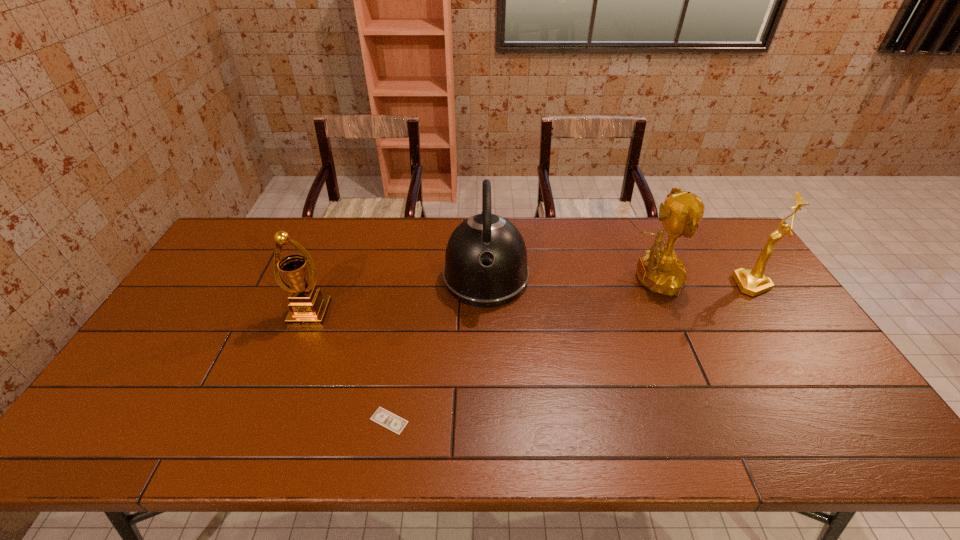
This screenshot has width=960, height=540. In order to click on vacant area that lies between the third object from left to right and the second award from right to left in this screenshot , I will do `click(567, 279)`.

What are the coordinates of `empty location between the shortest object and the second object from right to left` in the screenshot? It's located at (519, 350).

Find the location of a particular element. The width and height of the screenshot is (960, 540). unoccupied position between the rightmost object and the kettle is located at coordinates (619, 281).

Identify the location of vacant point located between the nearest object and the rightmost award. (571, 353).

You are a GUI agent. You are given a task and a screenshot of the screen. Output one action in this format:
    pyautogui.click(x=<x>, y=<y>)
    Task: Click on the vacant area that lies between the third object from right to left and the leftmost object
    
    Given the screenshot: What is the action you would take?
    pyautogui.click(x=398, y=295)

Identify the location of free space between the second award from right to left and the nearest object. The image size is (960, 540). (519, 350).

Locate an element on the screen. object that can be found as the third closest to the leftmost object is located at coordinates (661, 271).

Where is `object that is the closest to the leftmost object`? The image size is (960, 540). object that is the closest to the leftmost object is located at coordinates (383, 417).

Identify which award is the closest to the leftmost object. Please provide its 2D coordinates. Your answer should be formatted as a tuple, i.e. [(x, y)], where the tuple contains the x and y coordinates of a point satisfying the conditions above.

[(661, 271)]

Where is `award that stands as the second closest to the third object from right to left`? The image size is (960, 540). award that stands as the second closest to the third object from right to left is located at coordinates (308, 307).